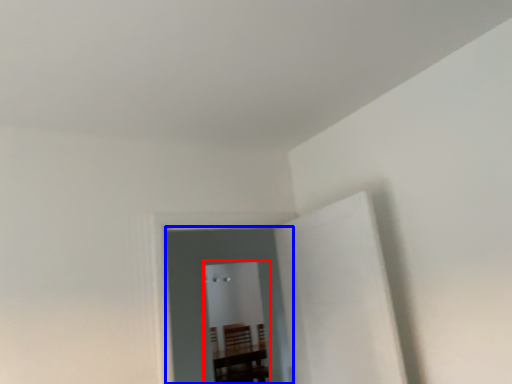
Question: Which of the following is the farthest to the observer, glass door (highlighted by a red box) or glass door (highlighted by a blue box)?

Choices:
 (A) glass door
 (B) glass door

Answer: (A)